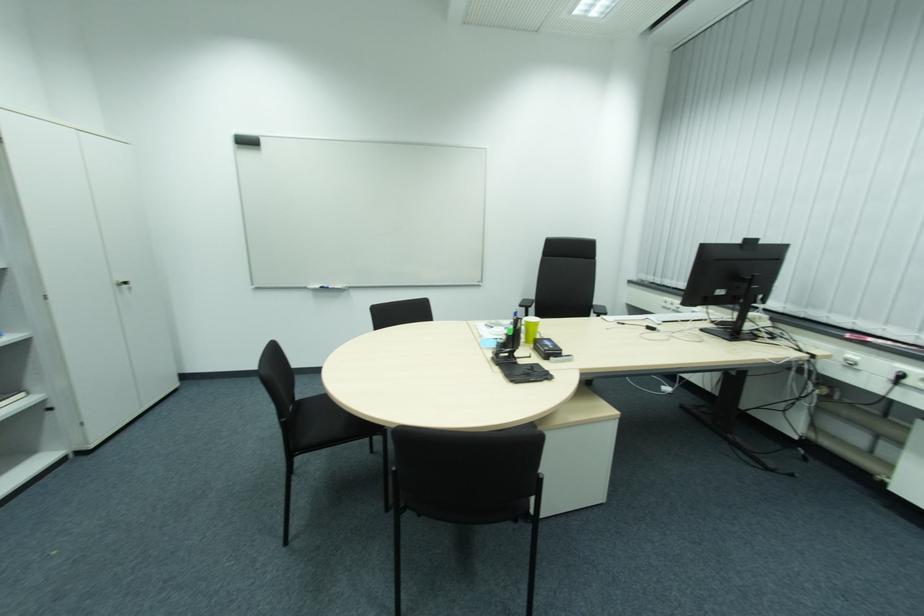
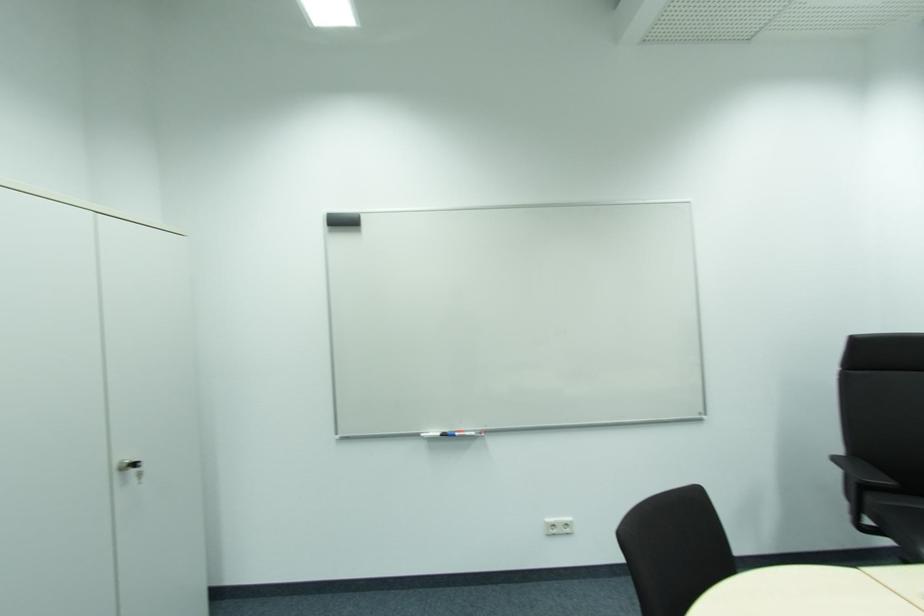
Where in the second image is the point corresponding to (x=131, y=283) from the first image?

(140, 464)